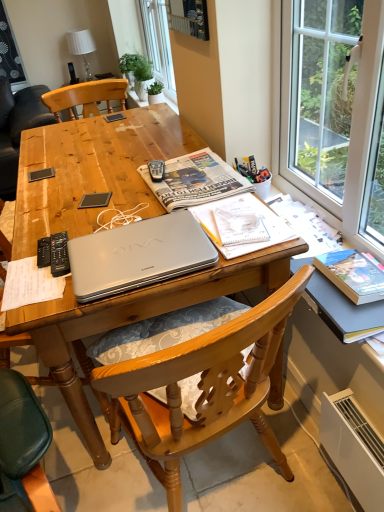
Question: Can you confirm if white fabric lampshade at upper center is positioned to the right of wooden table at center?

Choices:
 (A) no
 (B) yes

Answer: (A)

Question: Is wooden table at center inside white fabric lampshade at upper center?

Choices:
 (A) no
 (B) yes

Answer: (A)

Question: Considering the relative sizes of white fabric lampshade at upper center and wooden table at center in the image provided, is white fabric lampshade at upper center wider than wooden table at center?

Choices:
 (A) yes
 (B) no

Answer: (B)

Question: From the image's perspective, is white fabric lampshade at upper center below wooden table at center?

Choices:
 (A) yes
 (B) no

Answer: (B)

Question: Does white fabric lampshade at upper center have a lesser width compared to wooden table at center?

Choices:
 (A) no
 (B) yes

Answer: (B)

Question: Can you confirm if white fabric lampshade at upper center is shorter than wooden table at center?

Choices:
 (A) yes
 (B) no

Answer: (A)

Question: Is black plastic remote control at left, which is counted as the first remote control, starting from the right, taller than black plastic remote control at left, which is counted as the second remote control, starting from the right?

Choices:
 (A) yes
 (B) no

Answer: (A)

Question: Considering the relative sizes of black plastic remote control at left, which is counted as the first remote control, starting from the right, and black plastic remote control at left, which is counted as the second remote control, starting from the right, in the image provided, is black plastic remote control at left, which is counted as the first remote control, starting from the right, bigger than black plastic remote control at left, which is counted as the second remote control, starting from the right,?

Choices:
 (A) no
 (B) yes

Answer: (B)

Question: From a real-world perspective, does black plastic remote control at left, positioned as the 2th remote control in left-to-right order, stand above black plastic remote control at left, which is counted as the first remote control, starting from the left?

Choices:
 (A) yes
 (B) no

Answer: (A)

Question: Is black plastic remote control at left, positioned as the 2th remote control in left-to-right order, next to black plastic remote control at left, which is counted as the second remote control, starting from the right?

Choices:
 (A) yes
 (B) no

Answer: (A)

Question: From a real-world perspective, does black plastic remote control at left, which is counted as the first remote control, starting from the right, sit lower than black plastic remote control at left, which is counted as the first remote control, starting from the left?

Choices:
 (A) yes
 (B) no

Answer: (B)

Question: Is black plastic remote control at left, positioned as the 2th remote control in left-to-right order, to the right of black plastic remote control at left, which is counted as the first remote control, starting from the left, from the viewer's perspective?

Choices:
 (A) no
 (B) yes

Answer: (B)

Question: Is silver metallic laptop at center turned away from black plastic remote control at left, which is counted as the first remote control, starting from the right?

Choices:
 (A) yes
 (B) no

Answer: (B)